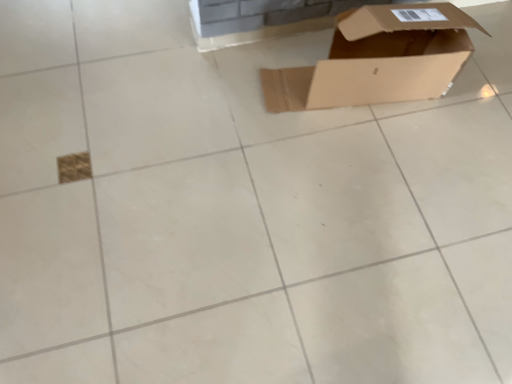
Where is `free space in front of brown cardboard box at upper right`? Image resolution: width=512 pixels, height=384 pixels. free space in front of brown cardboard box at upper right is located at coordinates [362, 185].